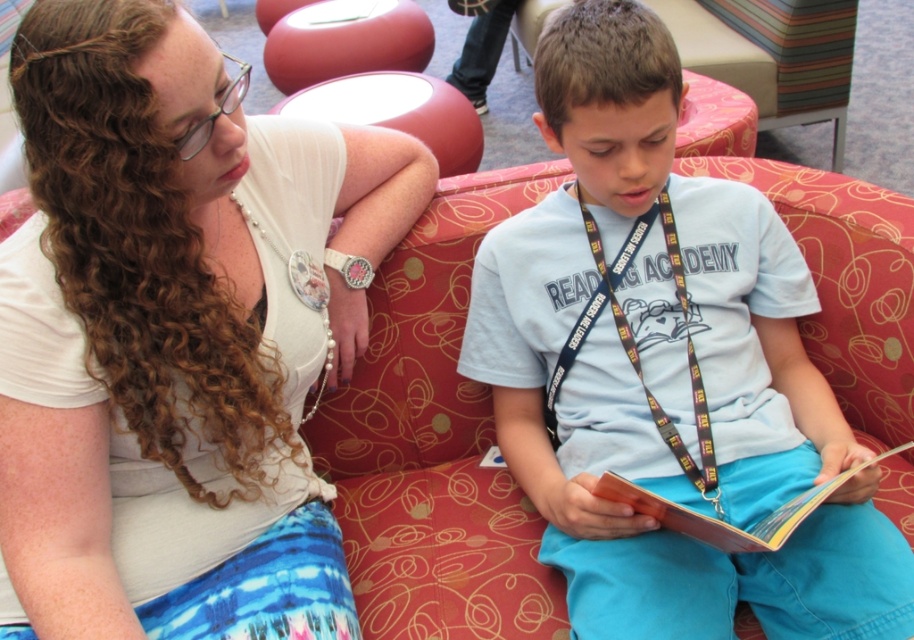
Question: Considering the real-world distances, which object is closest to the black fabric lanyard at center?

Choices:
 (A) white matte tank top at upper left
 (B) hardcover book at center

Answer: (B)

Question: Can you confirm if white matte tank top at upper left is bigger than light blue cotton shirt at center?

Choices:
 (A) no
 (B) yes

Answer: (B)

Question: Among these points, which one is farthest from the camera?

Choices:
 (A) (342, 611)
 (B) (868, 513)
 (C) (694, 481)
 (D) (723, 548)

Answer: (C)

Question: Based on their relative distances, which object is nearer to the hardcover book at center?

Choices:
 (A) light blue cotton shirt at center
 (B) white matte tank top at upper left
 (C) black fabric lanyard at center

Answer: (A)

Question: Can you confirm if white matte tank top at upper left is positioned to the left of black fabric lanyard at center?

Choices:
 (A) no
 (B) yes

Answer: (B)

Question: Can you confirm if white matte tank top at upper left is positioned to the left of hardcover book at center?

Choices:
 (A) yes
 (B) no

Answer: (A)